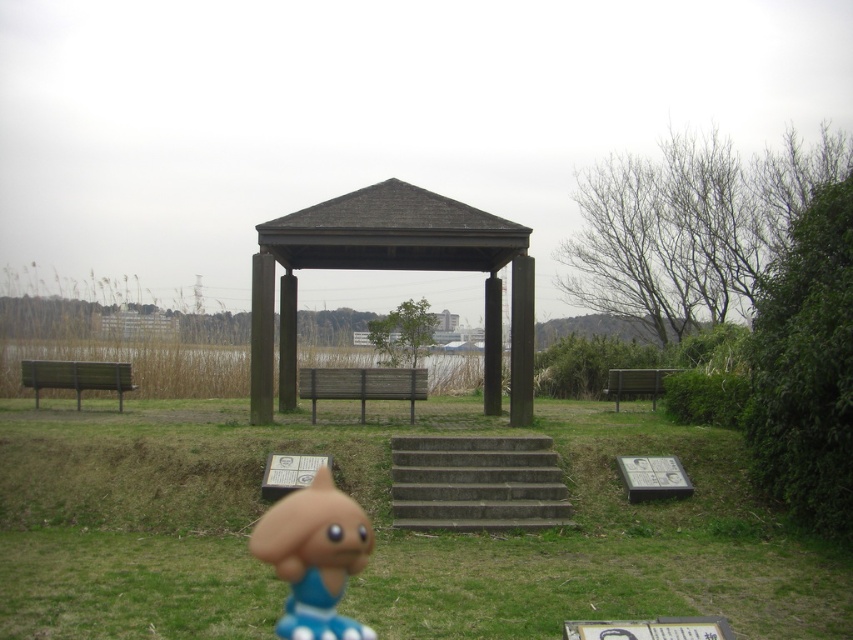
Question: Is brown wood gazebo at center closer to camera compared to wooden bench at left?

Choices:
 (A) yes
 (B) no

Answer: (A)

Question: In this image, where is green grassy at center located relative to wooden bench at center?

Choices:
 (A) below
 (B) above

Answer: (A)

Question: Which object is the farthest from the wooden bench at center?

Choices:
 (A) matte orange toy at lower center
 (B) wooden bench at left
 (C) brown wood gazebo at center

Answer: (A)

Question: Where is wooden bench at left located in relation to wooden bench at right in the image?

Choices:
 (A) above
 (B) below

Answer: (A)

Question: Estimate the real-world distances between objects in this image. Which object is closer to the green grassy at center?

Choices:
 (A) wooden bench at right
 (B) matte orange toy at lower center
 (C) wooden bench at left
 (D) brown wood gazebo at center

Answer: (D)

Question: Considering the real-world distances, which object is closest to the brown wood gazebo at center?

Choices:
 (A) concrete/steps at center
 (B) green grassy at center
 (C) wooden bench at right
 (D) wooden bench at left

Answer: (A)